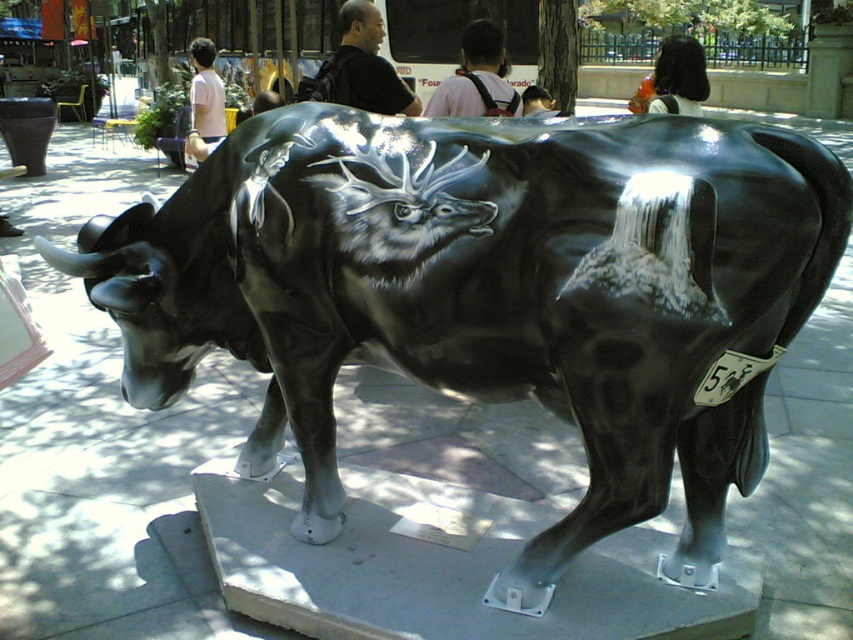
Looking at the sculpture of the bull, which hair is positioned lower between the black hair at upper center and the smooth brown hair at upper center?

The black hair at upper center is located below the smooth brown hair at upper center.

You are an artist observing the sculpture of a bull in the image. You notice a person in the background wearing a black shirt at upper center and has smooth brown hair at upper center. Which part of the person is more noticeable to you?

The black shirt at upper center is larger in size than the smooth brown hair at upper center, so the black shirt at upper center is more noticeable.